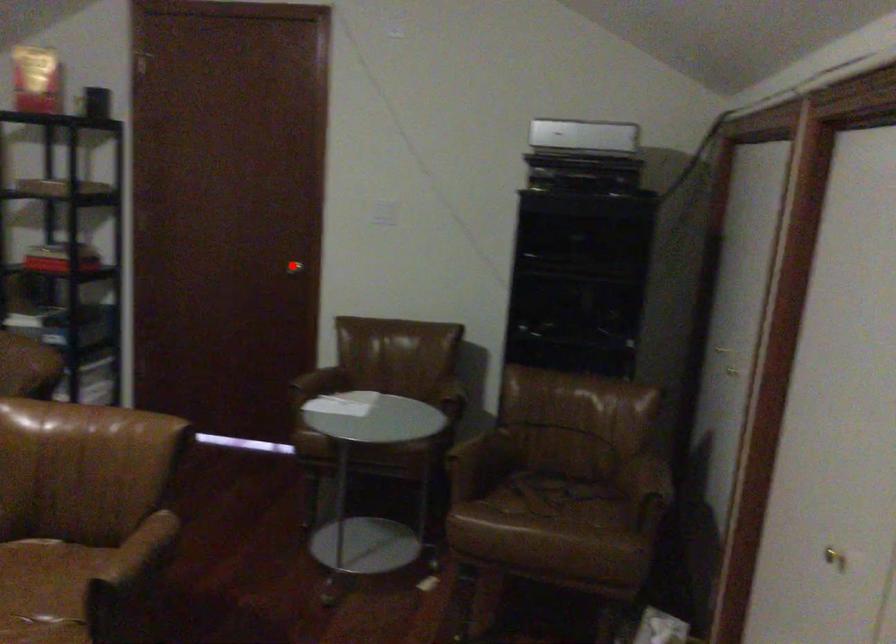
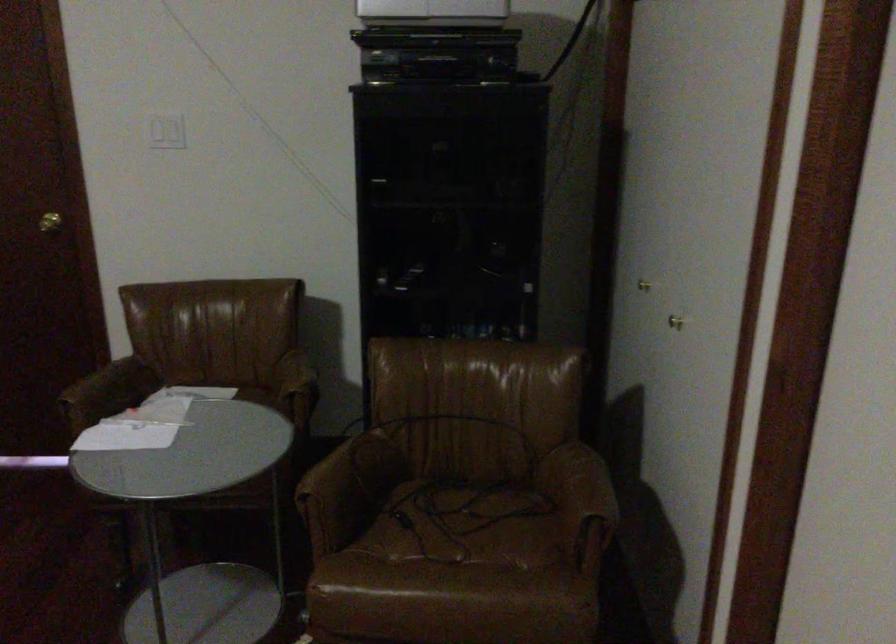
Question: I am providing you with two images of the same scene from different viewpoints. In image1, a red point is highlighted. Considering the same 3D point in image2, which of the following is correct?

Choices:
 (A) It is closer
 (B) It is farther

Answer: (A)